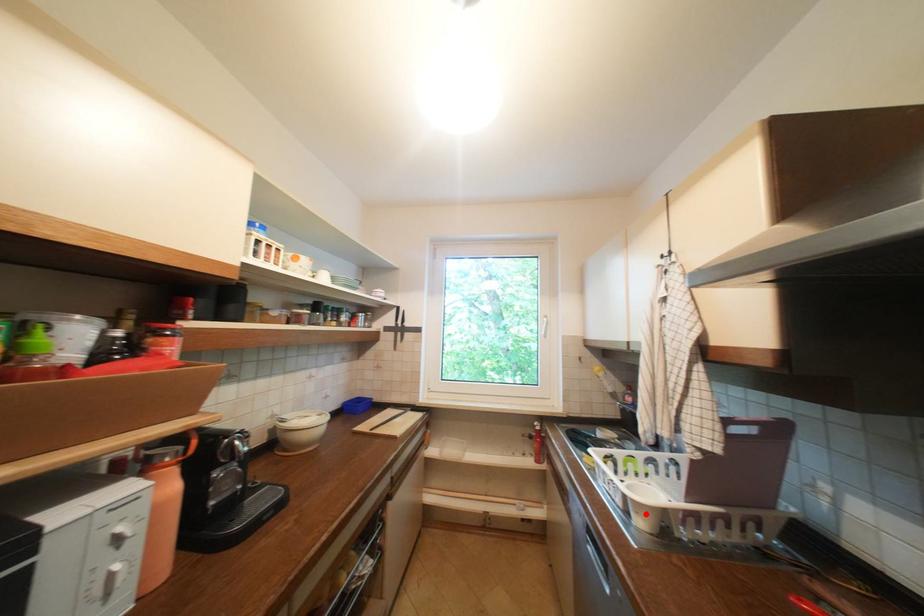
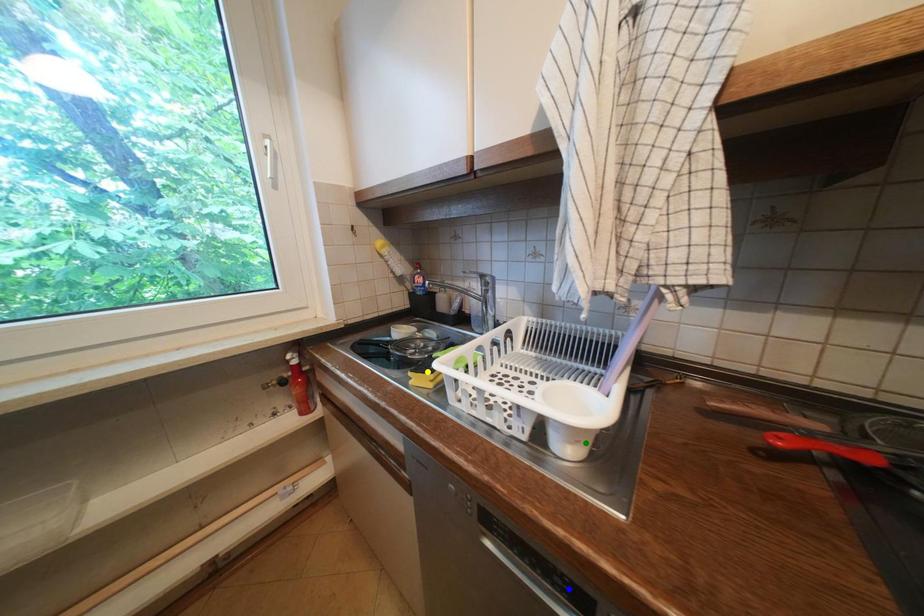
Question: I am providing you with two images of the same scene from different viewpoints. A red point is marked on the first image. You are given multiple points on the second image. Can you choose the point in image 2 that corresponds to the point in image 1?

Choices:
 (A) yellow point
 (B) green point
 (C) blue point

Answer: (B)